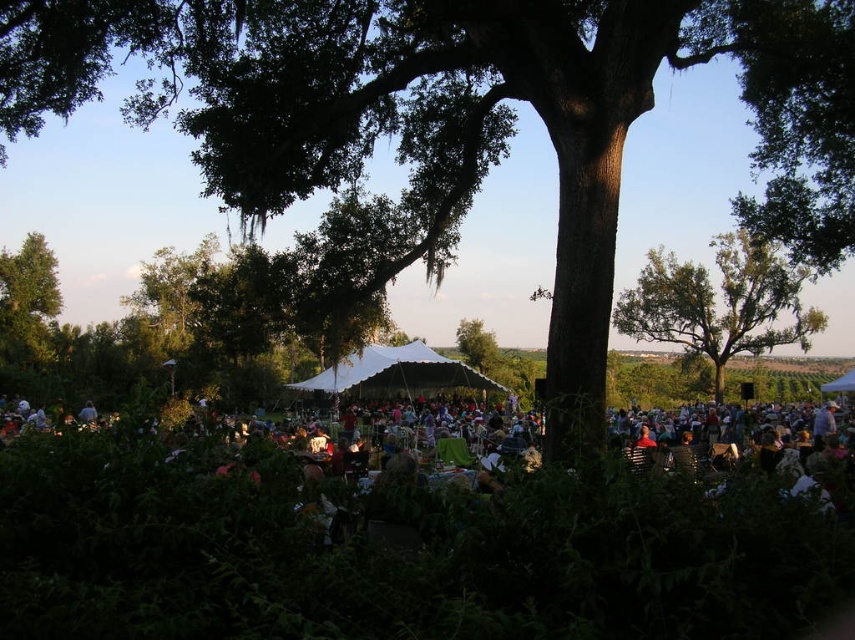
Question: Based on their relative distances, which object is nearer to the green leafy tree at left?

Choices:
 (A) green leafy tree at upper center
 (B) white fabric canopy at center
 (C) green leafy tree at center

Answer: (B)

Question: Which object is the farthest from the green leafy tree at center?

Choices:
 (A) white fabric canopy at center
 (B) green leafy tree at upper center

Answer: (B)

Question: Which object is closer to the camera taking this photo?

Choices:
 (A) green leafy tree at upper center
 (B) green leafy tree at center

Answer: (A)

Question: Does green leafy tree at upper center have a greater width compared to white fabric canopy at center?

Choices:
 (A) yes
 (B) no

Answer: (A)

Question: Does green leafy tree at upper center have a larger size compared to green leafy tree at left?

Choices:
 (A) no
 (B) yes

Answer: (B)

Question: Does green leafy tree at upper center have a greater width compared to green leafy tree at left?

Choices:
 (A) yes
 (B) no

Answer: (A)